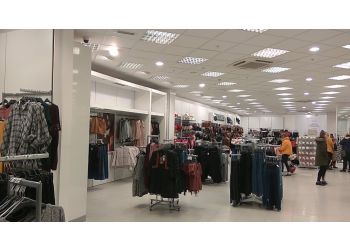
Where is `floor`? Image resolution: width=350 pixels, height=250 pixels. floor is located at coordinates (306, 208).